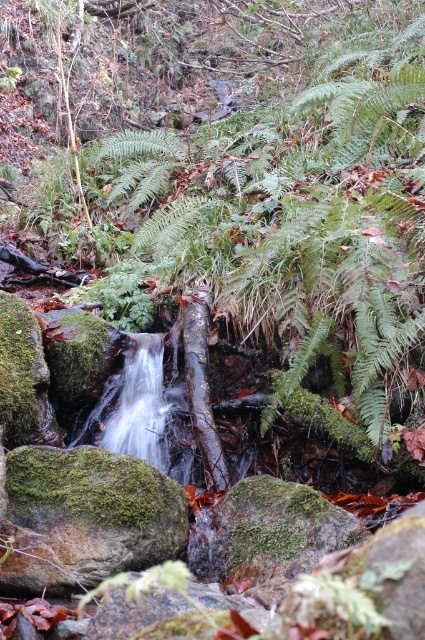
Does point (311, 500) come behind point (155, 369)?

No, it is in front of (155, 369).

The image size is (425, 640). Find the location of `green mossy rock at center`. green mossy rock at center is located at coordinates (269, 531).

Describe the element at coordinates (85, 516) in the screenshot. I see `green mossy rock at lower left` at that location.

Is point (40, 566) closer to viewer compared to point (124, 400)?

Yes, point (40, 566) is in front of point (124, 400).

This screenshot has width=425, height=640. In order to click on green mossy rock at lower left in this screenshot , I will do `click(85, 516)`.

Consider the image. Which is above, green mossy rock at lower left or green mossy rock at center?

green mossy rock at lower left

Does green mossy rock at lower left have a greater height compared to green mossy rock at center?

Correct, green mossy rock at lower left is much taller as green mossy rock at center.

Between point (87, 576) and point (285, 534), which one is positioned behind?

Positioned behind is point (285, 534).

At what (x,y) coordinates should I click in order to perform the action: click on green mossy rock at lower left. Please return your answer as a coordinate pair (x, y). The image size is (425, 640). Looking at the image, I should click on (85, 516).